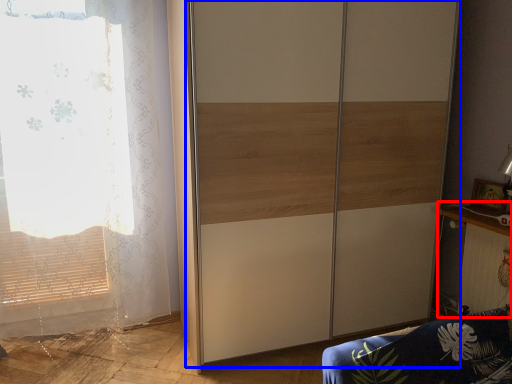
Question: Which of the following is the closest to the observer, table (highlighted by a red box) or screen door (highlighted by a blue box)?

Choices:
 (A) table
 (B) screen door

Answer: (B)